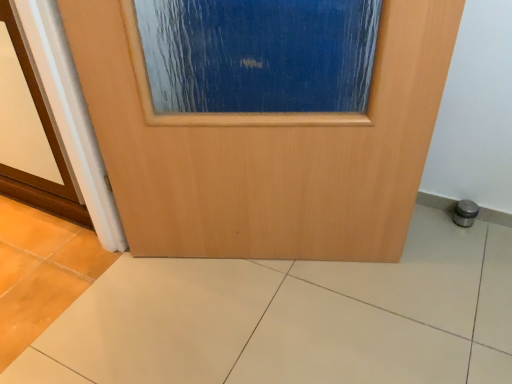
The image size is (512, 384). Find the location of `vacant area to the right of wooden door at center`. vacant area to the right of wooden door at center is located at coordinates (417, 288).